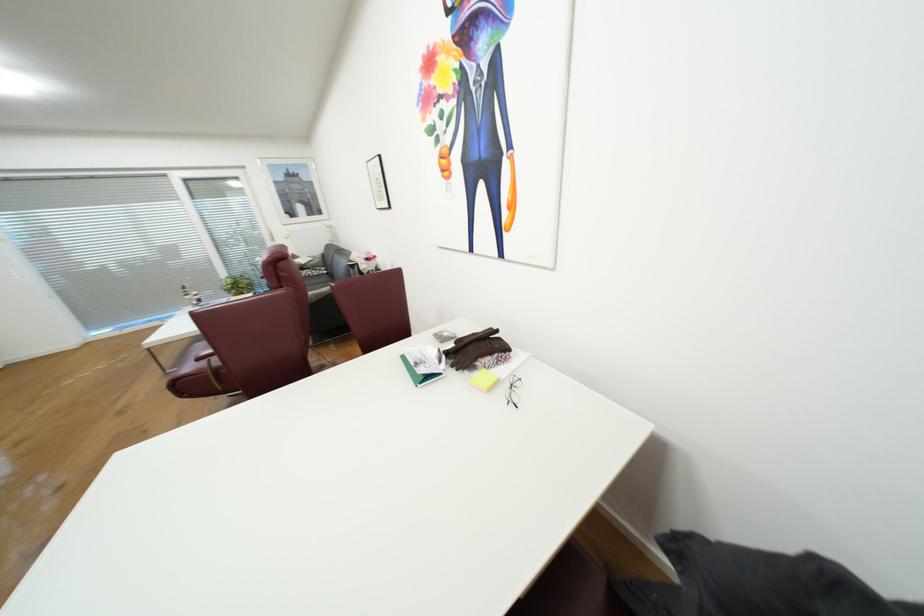
Describe the element at coordinates (315, 281) in the screenshot. The width and height of the screenshot is (924, 616). I see `the sofa sitting surface` at that location.